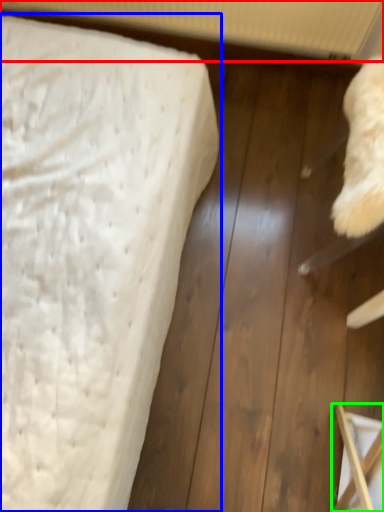
Question: Which object is positioned closest to radiator (highlighted by a red box)? Select from bed (highlighted by a blue box) and furniture (highlighted by a green box).

Choices:
 (A) bed
 (B) furniture

Answer: (A)